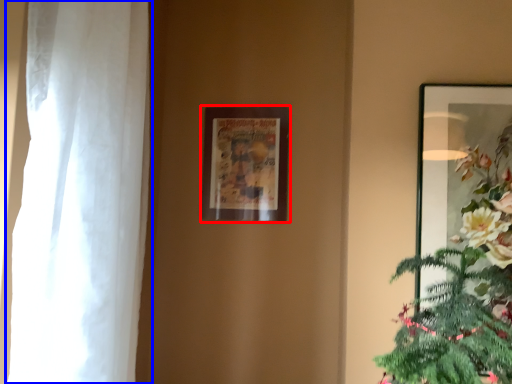
Question: Which object is further to the camera taking this photo, picture frame (highlighted by a red box) or curtain (highlighted by a blue box)?

Choices:
 (A) picture frame
 (B) curtain

Answer: (A)